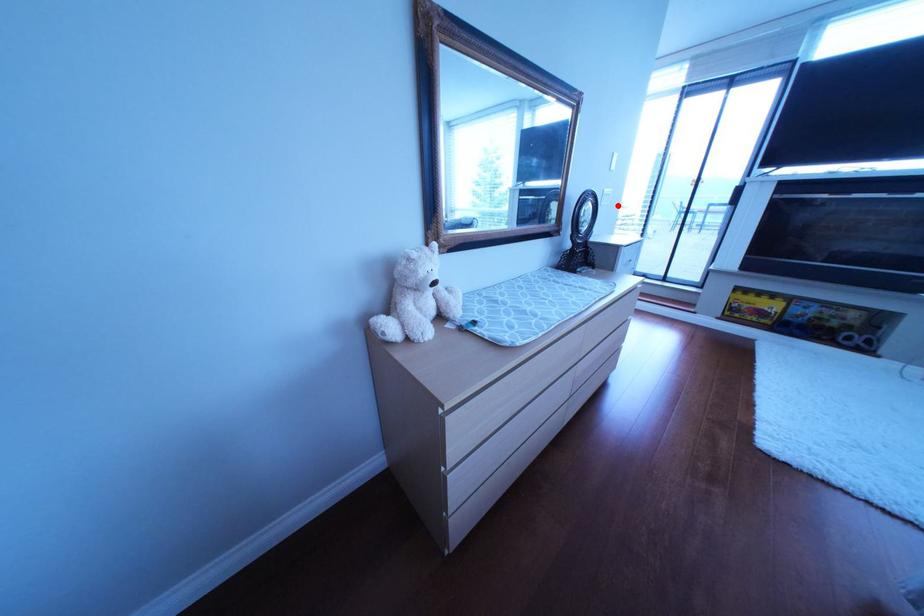
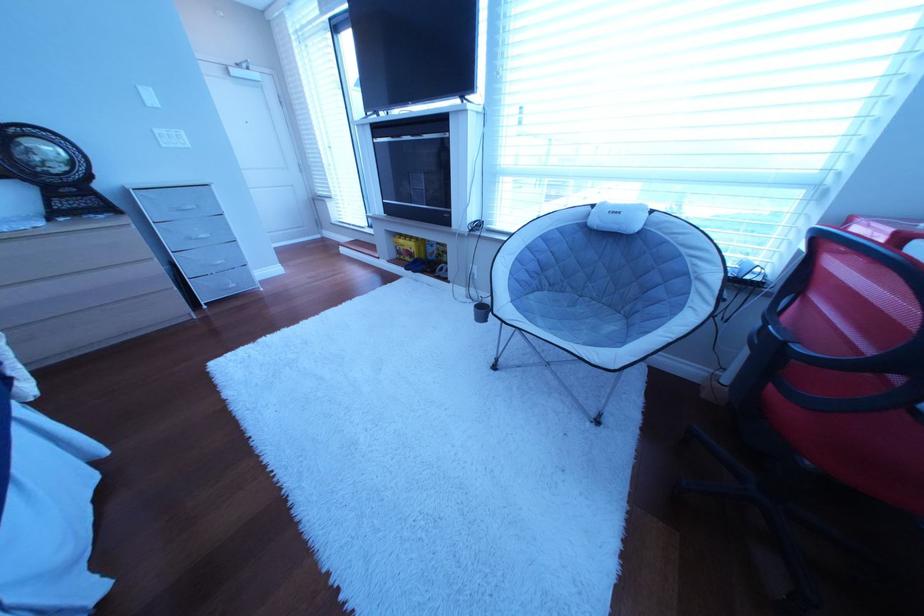
Question: I am providing you with two images of the same scene from different viewpoints. A red point is shown in image1. For the corresponding object point in image2, is it positioned nearer or farther from the camera?

Choices:
 (A) Nearer
 (B) Farther

Answer: (B)